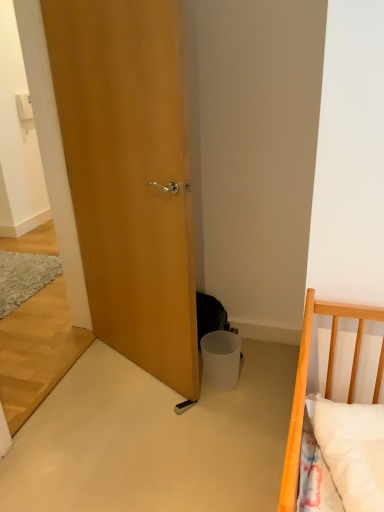
You are a GUI agent. You are given a task and a screenshot of the screen. Output one action in this format:
    pyautogui.click(x=<x>, y=<y>)
    Task: Click on the unoccupied region to the right of wooden door at center
    The height and width of the screenshot is (512, 384).
    Given the screenshot: What is the action you would take?
    (255, 389)